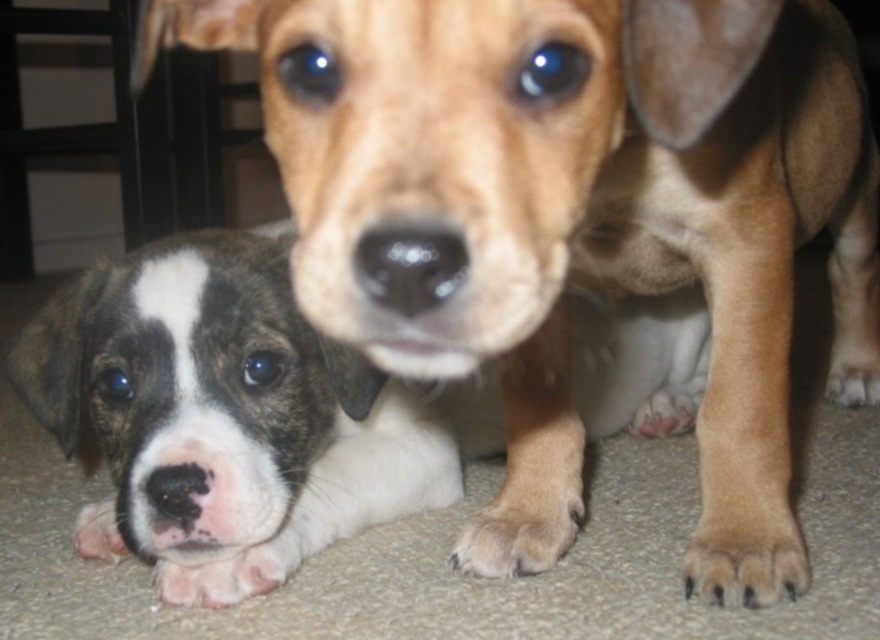
You are standing in the room where the two puppies are resting. You see a point marked at coordinates (x=745, y=554). Which object does this point correspond to?

The point at coordinates (x=745, y=554) corresponds to the brown furry paw at lower right.

You are a photographer setting up a camera at the same level as the puppies. You want to ensure both brown fur paw at lower center and pink soft fur paw at lower left are in focus. Which paw should you focus on first to ensure the other is also in focus?

The brown fur paw at lower center is taller than the pink soft fur paw at lower left. By focusing on the brown fur paw at lower center first, the depth of field will likely include the pink soft fur paw at lower left since it is closer to the camera and shorter.